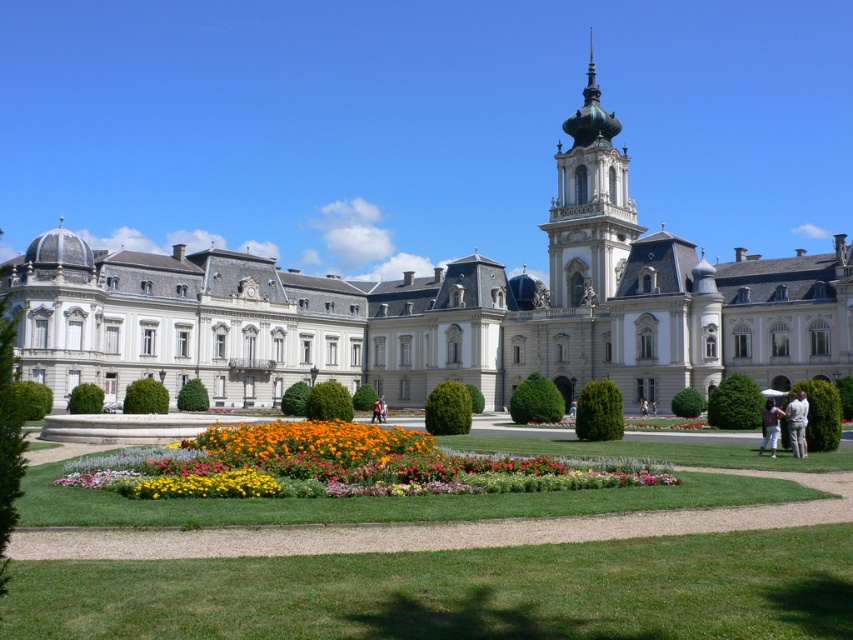
Where is `vibrant multicolored flowers at center`? vibrant multicolored flowers at center is located at coordinates (341, 465).

The width and height of the screenshot is (853, 640). Find the location of `vibrant multicolored flowers at center`. vibrant multicolored flowers at center is located at coordinates (341, 465).

Who is lower down, white stone palace at center or white fabric shirt at lower right?

white fabric shirt at lower right

Between white stone palace at center and white fabric shirt at lower right, which one has less height?

white fabric shirt at lower right

This screenshot has width=853, height=640. Identify the location of white stone palace at center. (444, 308).

Is green grass at center positioned before vibrant multicolored flowers at center?

Yes, it is in front of vibrant multicolored flowers at center.

Does green grass at center appear under vibrant multicolored flowers at center?

Correct, green grass at center is located below vibrant multicolored flowers at center.

Which is in front, point (234, 596) or point (100, 476)?

Point (234, 596)

Image resolution: width=853 pixels, height=640 pixels. I want to click on green grass at center, so click(x=457, y=592).